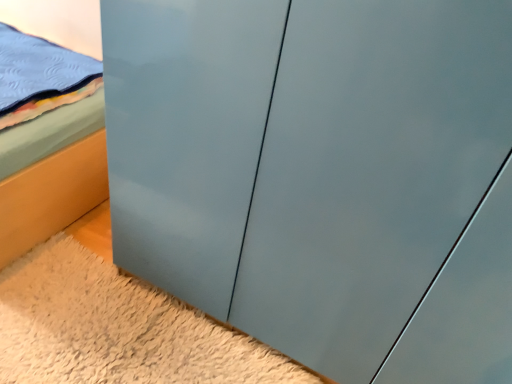
Question: Is matte gray cabinet at lower center positioned in front of matte blue bed at left?

Choices:
 (A) no
 (B) yes

Answer: (B)

Question: Considering the relative positions of matte gray cabinet at lower center and matte blue bed at left in the image provided, is matte gray cabinet at lower center to the right of matte blue bed at left from the viewer's perspective?

Choices:
 (A) no
 (B) yes

Answer: (B)

Question: Is matte gray cabinet at lower center completely or partially outside of matte blue bed at left?

Choices:
 (A) yes
 (B) no

Answer: (A)

Question: Is matte gray cabinet at lower center facing away from matte blue bed at left?

Choices:
 (A) yes
 (B) no

Answer: (A)

Question: Considering the relative sizes of matte gray cabinet at lower center and matte blue bed at left in the image provided, is matte gray cabinet at lower center thinner than matte blue bed at left?

Choices:
 (A) no
 (B) yes

Answer: (A)

Question: Does matte gray cabinet at lower center come behind matte blue bed at left?

Choices:
 (A) yes
 (B) no

Answer: (B)

Question: From the image's perspective, would you say matte blue bed at left is positioned over matte gray cabinet at lower center?

Choices:
 (A) yes
 (B) no

Answer: (A)

Question: Does matte blue bed at left appear on the left side of matte gray cabinet at lower center?

Choices:
 (A) no
 (B) yes

Answer: (B)

Question: From a real-world perspective, is matte blue bed at left positioned over matte gray cabinet at lower center based on gravity?

Choices:
 (A) no
 (B) yes

Answer: (B)

Question: Is matte blue bed at left located outside matte gray cabinet at lower center?

Choices:
 (A) no
 (B) yes

Answer: (B)

Question: Can you see matte blue bed at left touching matte gray cabinet at lower center?

Choices:
 (A) yes
 (B) no

Answer: (B)

Question: Is matte blue bed at left at the right side of matte gray cabinet at lower center?

Choices:
 (A) yes
 (B) no

Answer: (B)

Question: From a real-world perspective, relative to matte blue bed at left, is matte gray cabinet at lower center vertically above or below?

Choices:
 (A) below
 (B) above

Answer: (A)